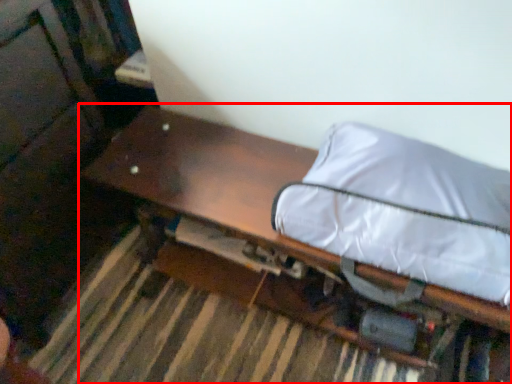
Question: From the image's perspective, where is furniture (annotated by the red box) located relative to bean bag chair?

Choices:
 (A) below
 (B) above

Answer: (A)